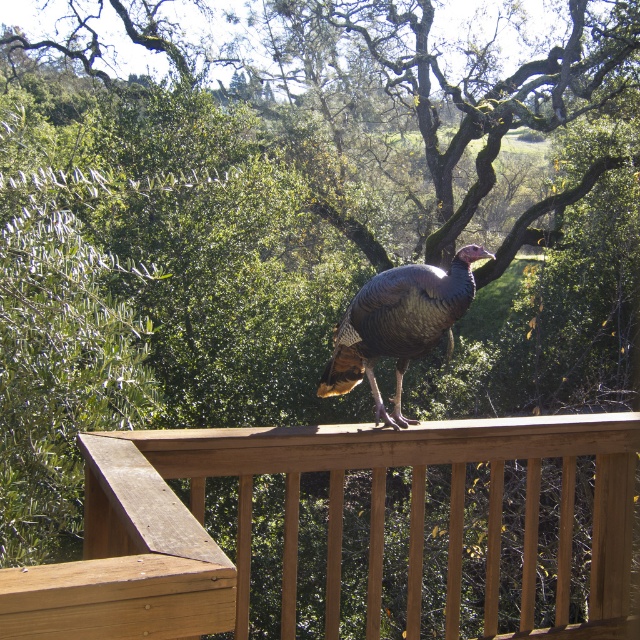
Which is behind, point (145, 531) or point (356, 352)?

Positioned behind is point (356, 352).

Is point (195, 449) positioned behind point (349, 365)?

That is False.

Identify the location of brown wooden railing at upper center. The image size is (640, 640). (328, 524).